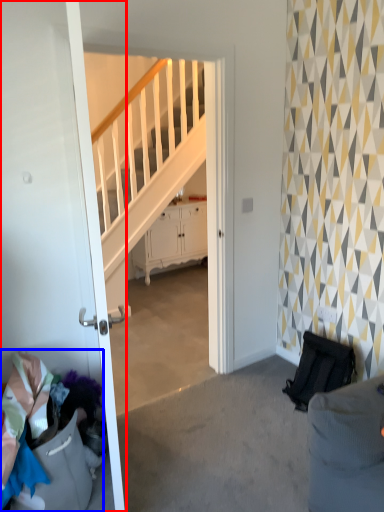
Question: Among these objects, which one is farthest to the camera, door (highlighted by a red box) or laundry (highlighted by a blue box)?

Choices:
 (A) door
 (B) laundry

Answer: (B)